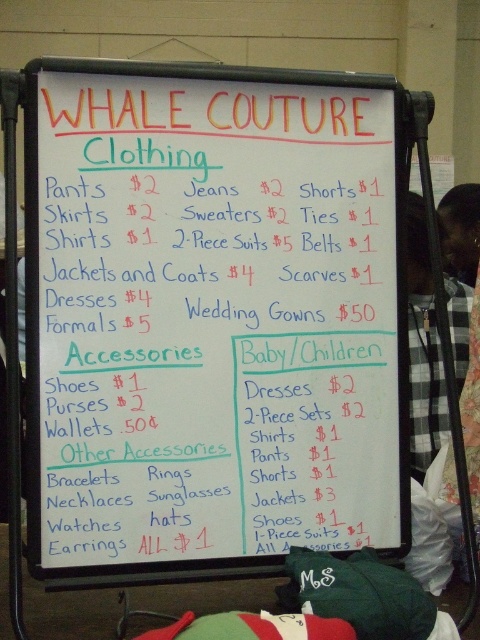
Question: Which object is closer to the camera taking this photo?

Choices:
 (A) black checkered shirt at right
 (B) white paperboard at center

Answer: (B)

Question: Considering the relative positions of white paperboard at center and black checkered shirt at right in the image provided, where is white paperboard at center located with respect to black checkered shirt at right?

Choices:
 (A) right
 (B) left

Answer: (B)

Question: Which object is closer to the camera taking this photo?

Choices:
 (A) white paperboard at center
 (B) black checkered shirt at right

Answer: (A)

Question: Can you confirm if white paperboard at center is wider than black checkered shirt at right?

Choices:
 (A) yes
 (B) no

Answer: (A)

Question: Which point is closer to the camera?

Choices:
 (A) black checkered shirt at right
 (B) white paperboard at center

Answer: (B)

Question: In this image, where is white paperboard at center located relative to black checkered shirt at right?

Choices:
 (A) right
 (B) left

Answer: (B)